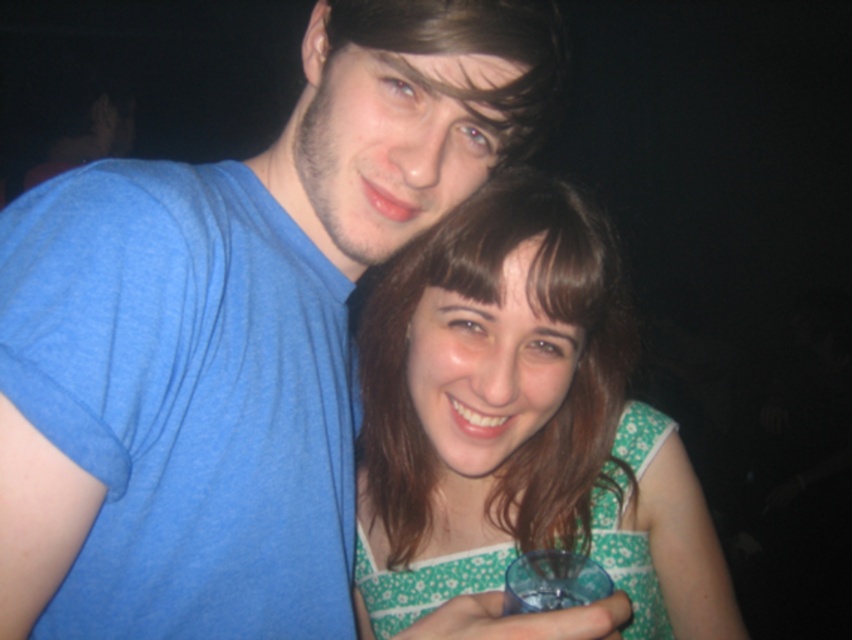
Question: Which of the following is the farthest from the observer?

Choices:
 (A) (14, 262)
 (B) (594, 353)

Answer: (B)

Question: In this image, where is blue cotton t-shirt at upper left located relative to green floral dress at center?

Choices:
 (A) left
 (B) right

Answer: (A)

Question: Can you confirm if blue cotton t-shirt at upper left is thinner than green floral dress at center?

Choices:
 (A) yes
 (B) no

Answer: (A)

Question: Which point is closer to the camera taking this photo?

Choices:
 (A) (395, 204)
 (B) (590, 291)

Answer: (A)

Question: Which of the following is the closest to the observer?

Choices:
 (A) green floral dress at center
 (B) blue cotton t-shirt at upper left

Answer: (B)

Question: Does blue cotton t-shirt at upper left have a larger size compared to green floral dress at center?

Choices:
 (A) yes
 (B) no

Answer: (A)